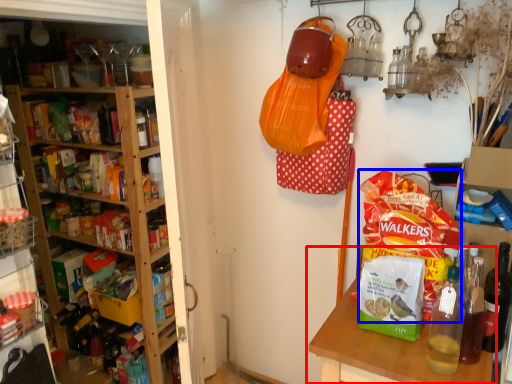
Question: Among these objects, which one is farthest to the camera, table (highlighted by a red box) or snack (highlighted by a blue box)?

Choices:
 (A) table
 (B) snack

Answer: (B)